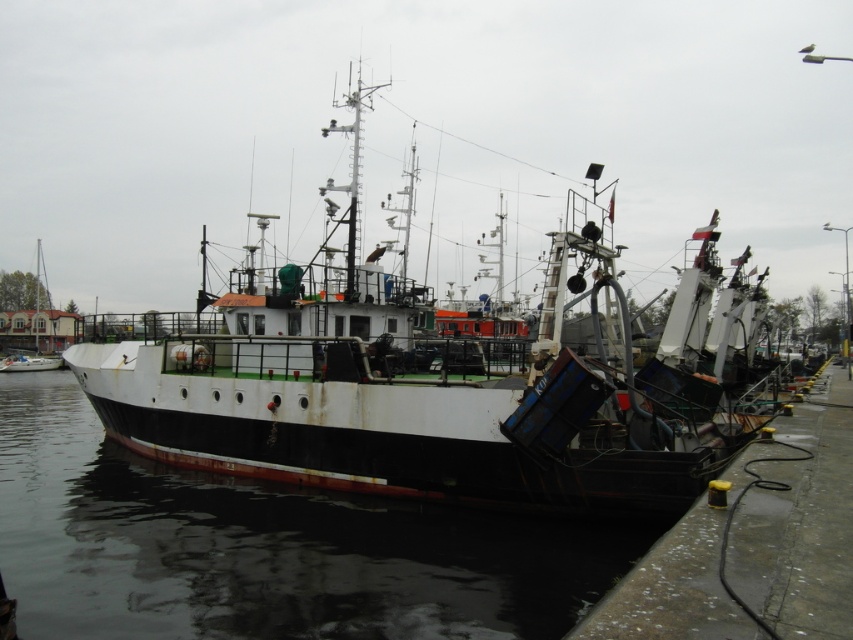
Is black matte water at lower left smaller than white matte boat at left?

Indeed, black matte water at lower left has a smaller size compared to white matte boat at left.

Between black matte water at lower left and white matte boat at left, which one appears on the right side from the viewer's perspective?

black matte water at lower left is more to the right.

Between point (514, 616) and point (44, 292), which one is positioned behind?

Positioned behind is point (44, 292).

You are a GUI agent. You are given a task and a screenshot of the screen. Output one action in this format:
    pyautogui.click(x=<x>, y=<y>)
    Task: Click on the black matte water at lower left
    The image size is (853, 640).
    Given the screenshot: What is the action you would take?
    pyautogui.click(x=264, y=547)

Does rusty metal boat at center have a lesser height compared to white matte boat at left?

Incorrect, rusty metal boat at center's height does not fall short of white matte boat at left's.

Who is more distant from viewer, (241,467) or (32,289)?

The point (32,289) is more distant.

Where is `rusty metal boat at center`? rusty metal boat at center is located at coordinates (453, 387).

Consider the image. Can you confirm if rusty metal boat at center is positioned to the left of black matte water at lower left?

Incorrect, rusty metal boat at center is not on the left side of black matte water at lower left.

Which is below, rusty metal boat at center or black matte water at lower left?

black matte water at lower left is below.

What are the coordinates of `rusty metal boat at center` in the screenshot? It's located at (453, 387).

At what (x,y) coordinates should I click in order to perform the action: click on rusty metal boat at center. Please return your answer as a coordinate pair (x, y). The height and width of the screenshot is (640, 853). Looking at the image, I should click on (453, 387).